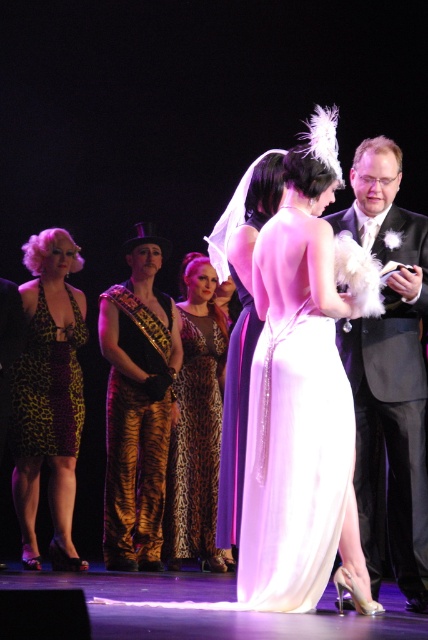
You are a photographer at a wedding ceremony. You need to position yourself so that both the shiny black suit at right and the leopard print fabric dress at left are in frame. Given their height difference, which subject should you adjust your camera angle to focus on to ensure both are fully visible?

The shiny black suit at right is much taller than the leopard print fabric dress at left. To ensure both are fully visible, you should adjust the camera angle to focus on the shiny black suit at right, as it is taller and requires capturing its full height while still including the leopard print fabric dress at left in the frame.

You are planning to sit between the shiny black suit at right and the tiger print pants at left. Which side should you choose if you want more space?

The tiger print pants at left has a greater width than the shiny black suit at right, so you should choose the left side for more space.

You are a photographer at a wedding event and need to position two guests wearing leopard print dresses for a photo. The leopard print dress at left and the leopard print fabric dress at left are both present. Which one should you move to the right side to ensure they are spaced apart properly?

The leopard print dress at left might be wider than leopard print fabric dress at left, so moving the leopard print dress at left to the right side would ensure proper spacing between them.